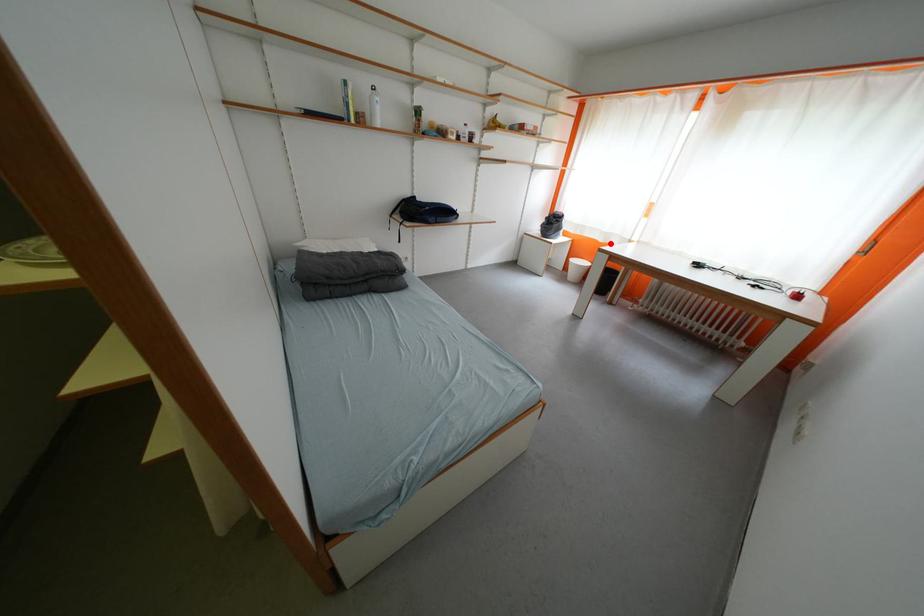
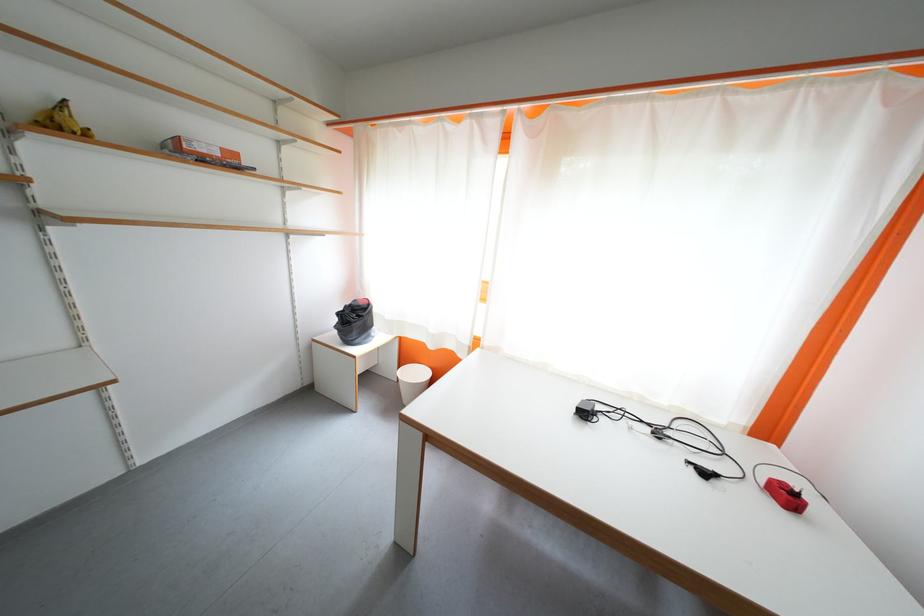
Question: A red point is marked in image1. In image2, is the corresponding 3D point closer to the camera or farther? Reply with the corresponding letter.

Choices:
 (A) The corresponding 3D point is closer.
 (B) The corresponding 3D point is farther.

Answer: (B)